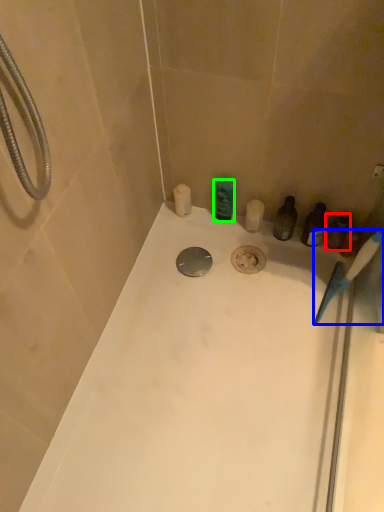
Question: Which object is positioned farthest from toiletry (highlighted by a red box)? Select from toothbrush (highlighted by a blue box) and toiletry (highlighted by a green box).

Choices:
 (A) toothbrush
 (B) toiletry

Answer: (B)